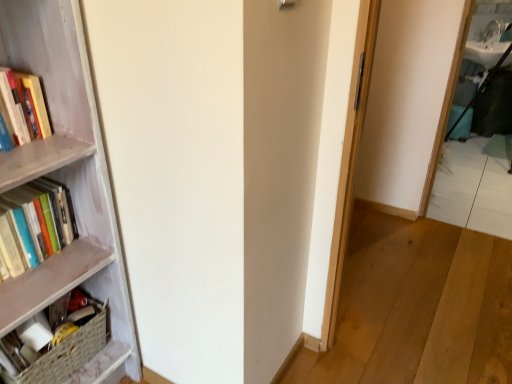
Question: Would you say hardcover books at left, marked as the 1th book in a top-to-bottom arrangement, contains woven basket at lower left, acting as the 2th book starting from the top?

Choices:
 (A) yes
 (B) no

Answer: (B)

Question: From a real-world perspective, is hardcover books at left, marked as the 1th book in a top-to-bottom arrangement, located beneath woven basket at lower left, acting as the 2th book starting from the top?

Choices:
 (A) no
 (B) yes

Answer: (A)

Question: Is hardcover books at left, the 2th book from the bottom, bigger than woven basket at lower left, arranged as the first book when ordered from the bottom?

Choices:
 (A) no
 (B) yes

Answer: (A)

Question: Is there a large distance between hardcover books at left, the 2th book from the bottom, and woven basket at lower left, arranged as the first book when ordered from the bottom?

Choices:
 (A) yes
 (B) no

Answer: (B)

Question: Is hardcover books at left, marked as the 1th book in a top-to-bottom arrangement, not within woven basket at lower left, acting as the 2th book starting from the top?

Choices:
 (A) yes
 (B) no

Answer: (A)

Question: From a real-world perspective, is hardcover books at left, the 2th book from the bottom, on woven basket at lower left, arranged as the first book when ordered from the bottom?

Choices:
 (A) no
 (B) yes

Answer: (B)

Question: Are wooden bookcase at left and woven basket at lower left, acting as the 2th book starting from the top, located far from each other?

Choices:
 (A) no
 (B) yes

Answer: (A)

Question: Is wooden bookcase at left touching woven basket at lower left, arranged as the first book when ordered from the bottom?

Choices:
 (A) no
 (B) yes

Answer: (A)

Question: From a real-world perspective, is wooden bookcase at left physically below woven basket at lower left, acting as the 2th book starting from the top?

Choices:
 (A) no
 (B) yes

Answer: (A)

Question: Can we say wooden bookcase at left lies outside woven basket at lower left, arranged as the first book when ordered from the bottom?

Choices:
 (A) yes
 (B) no

Answer: (A)

Question: Can woven basket at lower left, acting as the 2th book starting from the top, be found inside wooden bookcase at left?

Choices:
 (A) no
 (B) yes

Answer: (B)

Question: Considering the relative positions of wooden bookcase at left and woven basket at lower left, arranged as the first book when ordered from the bottom, in the image provided, is wooden bookcase at left to the left of woven basket at lower left, arranged as the first book when ordered from the bottom, from the viewer's perspective?

Choices:
 (A) yes
 (B) no

Answer: (B)

Question: Is woven basket at lower left, acting as the 2th book starting from the top, oriented towards wooden bookcase at left?

Choices:
 (A) yes
 (B) no

Answer: (A)